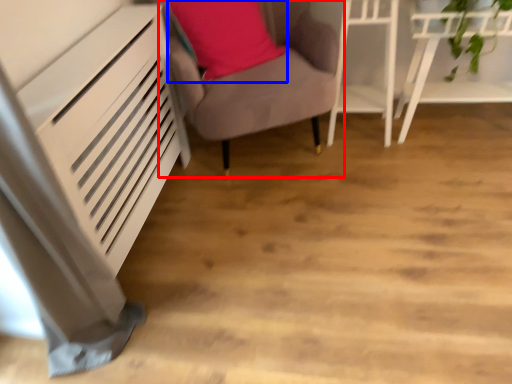
Question: Which object appears farthest to the camera in this image, furniture (highlighted by a red box) or pillow (highlighted by a blue box)?

Choices:
 (A) furniture
 (B) pillow

Answer: (B)